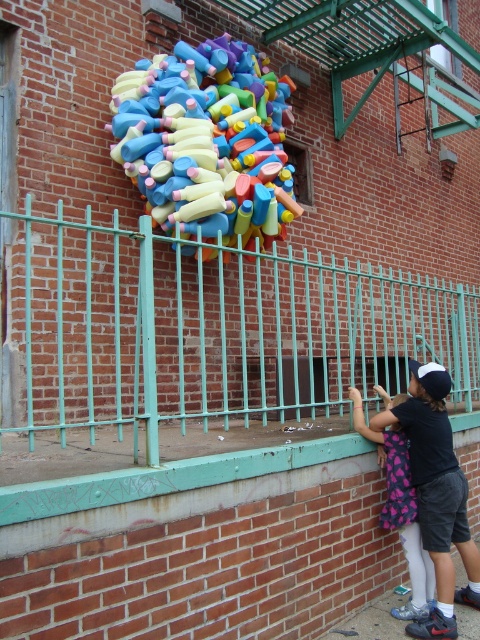
Question: Considering the real-world distances, which object is farthest from the black cotton shirt at lower right?

Choices:
 (A) multicolored plastic bottles at center
 (B) teal metal fence at center

Answer: (A)

Question: Which object is the closest to the black cotton shirt at lower right?

Choices:
 (A) multicolored plastic bottles at center
 (B) teal metal fence at center

Answer: (B)

Question: Can you confirm if multicolored plastic bottles at center is smaller than black cotton shirt at lower right?

Choices:
 (A) yes
 (B) no

Answer: (B)

Question: Does multicolored plastic bottles at center have a smaller size compared to black cotton shirt at lower right?

Choices:
 (A) no
 (B) yes

Answer: (A)

Question: Where is teal metal fence at center located in relation to black cotton shirt at lower right in the image?

Choices:
 (A) above
 (B) below

Answer: (A)

Question: Which object appears farthest from the camera in this image?

Choices:
 (A) teal metal fence at center
 (B) black cotton shirt at lower right
 (C) multicolored plastic bottles at center

Answer: (C)